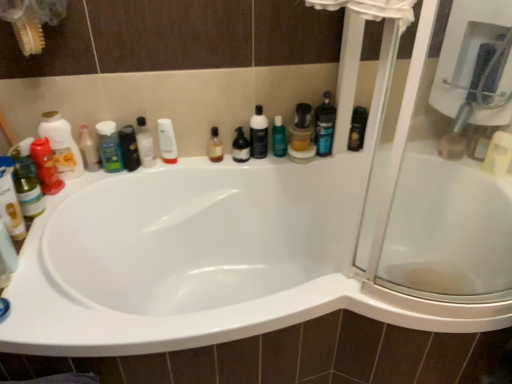
Question: Is blue glossy bottle at upper right, which ranks as the 7th toiletry in left-to-right order, wider than white glossy lotion at upper center, acting as the 5th toiletry starting from the left?

Choices:
 (A) no
 (B) yes

Answer: (B)

Question: From the image's perspective, does blue glossy bottle at upper right, the second toiletry in the right-to-left sequence, appear higher than white glossy lotion at upper center, acting as the 5th toiletry starting from the left?

Choices:
 (A) no
 (B) yes

Answer: (B)

Question: Does blue glossy bottle at upper right, which ranks as the 7th toiletry in left-to-right order, touch white glossy lotion at upper center, acting as the 5th toiletry starting from the left?

Choices:
 (A) no
 (B) yes

Answer: (A)

Question: Considering the relative sizes of blue glossy bottle at upper right, the second toiletry in the right-to-left sequence, and white glossy lotion at upper center, arranged as the 4th toiletry when viewed from the right, in the image provided, is blue glossy bottle at upper right, the second toiletry in the right-to-left sequence, smaller than white glossy lotion at upper center, arranged as the 4th toiletry when viewed from the right,?

Choices:
 (A) yes
 (B) no

Answer: (B)

Question: Does blue glossy bottle at upper right, the second toiletry in the right-to-left sequence, have a lesser height compared to white glossy lotion at upper center, acting as the 5th toiletry starting from the left?

Choices:
 (A) no
 (B) yes

Answer: (A)

Question: Considering the relative positions of blue glossy bottle at upper right, the second toiletry in the right-to-left sequence, and white glossy lotion at upper center, arranged as the 4th toiletry when viewed from the right, in the image provided, is blue glossy bottle at upper right, the second toiletry in the right-to-left sequence, to the right of white glossy lotion at upper center, arranged as the 4th toiletry when viewed from the right, from the viewer's perspective?

Choices:
 (A) yes
 (B) no

Answer: (A)

Question: Considering the relative sizes of black glossy bottle at upper left, the third mouthwash from the right, and green matte shampoo at left, marked as the sixth toiletry in a right-to-left arrangement, in the image provided, is black glossy bottle at upper left, the third mouthwash from the right, bigger than green matte shampoo at left, marked as the sixth toiletry in a right-to-left arrangement,?

Choices:
 (A) no
 (B) yes

Answer: (A)

Question: From a real-world perspective, is black glossy bottle at upper left, the third mouthwash from the right, on top of green matte shampoo at left, marked as the sixth toiletry in a right-to-left arrangement?

Choices:
 (A) yes
 (B) no

Answer: (B)

Question: Is black glossy bottle at upper left, the third mouthwash from the right, thinner than green matte shampoo at left, positioned as the 3th toiletry in left-to-right order?

Choices:
 (A) yes
 (B) no

Answer: (B)

Question: Considering the relative positions of black glossy bottle at upper left, the third mouthwash from the right, and green matte shampoo at left, marked as the sixth toiletry in a right-to-left arrangement, in the image provided, is black glossy bottle at upper left, the third mouthwash from the right, in front of green matte shampoo at left, marked as the sixth toiletry in a right-to-left arrangement,?

Choices:
 (A) no
 (B) yes

Answer: (A)

Question: Can you confirm if black glossy bottle at upper left, which is the 1th mouthwash in left-to-right order, is wider than green matte shampoo at left, marked as the sixth toiletry in a right-to-left arrangement?

Choices:
 (A) yes
 (B) no

Answer: (A)

Question: Is black glossy bottle at upper left, which is the 1th mouthwash in left-to-right order, far away from green matte shampoo at left, marked as the sixth toiletry in a right-to-left arrangement?

Choices:
 (A) yes
 (B) no

Answer: (B)

Question: Is black plastic bottle at upper right, the eighth toiletry when ordered from left to right, wider than black glossy bottle at upper left, the third mouthwash from the right?

Choices:
 (A) yes
 (B) no

Answer: (B)